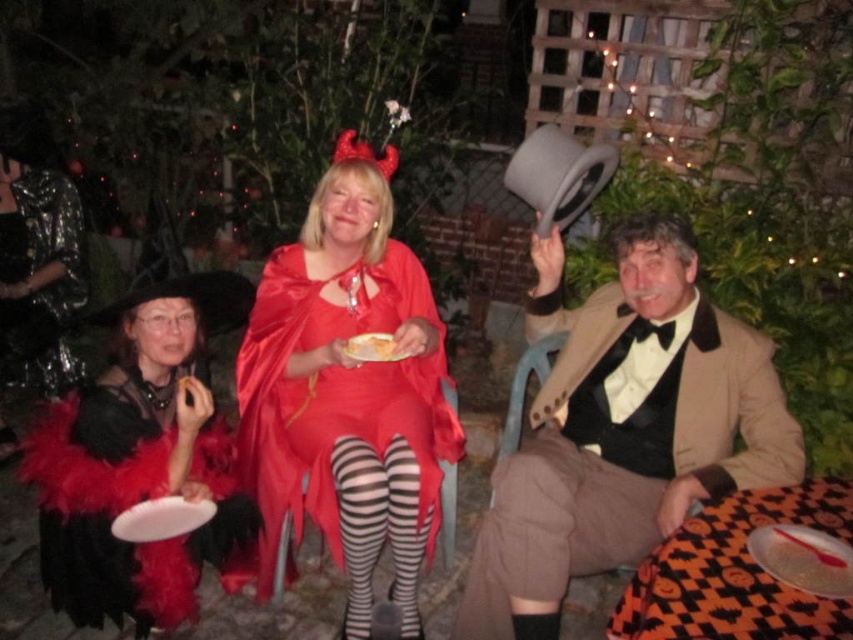
You are a photographer at the Halloween party. You need to take a photo of the black feather boa at left and the matte silver platter at lower right. Which object should you zoom in more on to ensure both are clearly visible in the frame?

The black feather boa at left is larger in size than the matte silver platter at lower right, so you should zoom in more on the matte silver platter at lower right to ensure both are clearly visible in the frame.

You are a photographer trying to capture a clear shot of both the brown cotton pants at lower right and the shiny black cape at left. Which one should you focus on first to ensure both are in focus?

You should focus on the brown cotton pants at lower right first because it is closer to the viewer than the shiny black cape at left, so adjusting focus from near to far will help both be in focus.

You are a photographer taking a picture of the brown wool suit at right and the matte silver platter at lower right. Which object should you focus on first to ensure both are in frame?

The brown wool suit at right is above the matte silver platter at lower right, so you should focus on the brown wool suit at right first to ensure both are in frame.